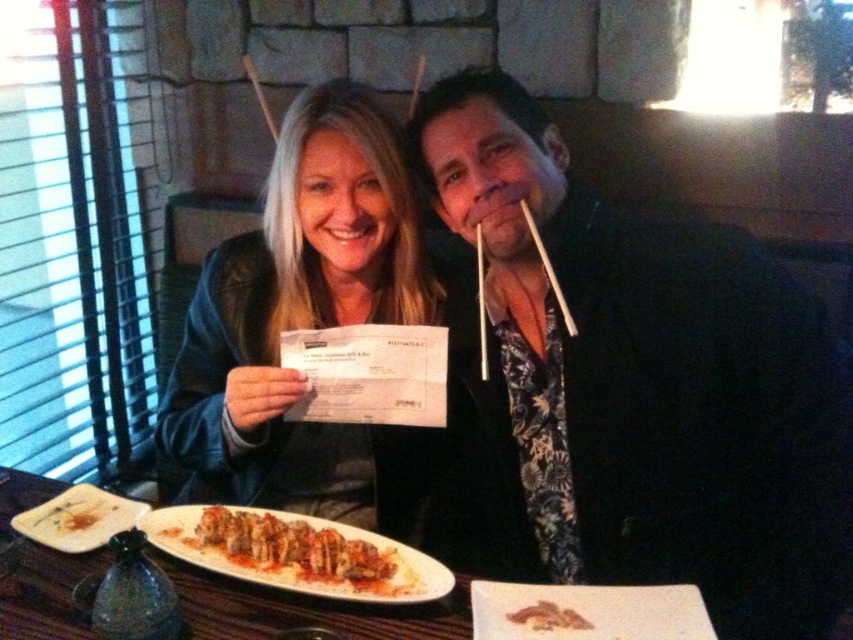
Which is below, matte black jacket at center or golden crispy chicken at center?

golden crispy chicken at center

Between point (256, 502) and point (322, 564), which one is positioned in front?

Positioned in front is point (322, 564).

Based on the photo, who is more forward, (303, 484) or (389, 589)?

Point (389, 589)

The width and height of the screenshot is (853, 640). I want to click on matte black jacket at center, so click(305, 323).

Does matte black jacket at center have a lesser height compared to brown crispy sushi at center?

Incorrect, matte black jacket at center's height does not fall short of brown crispy sushi at center's.

Who is more forward, [271,168] or [509,614]?

Point [509,614] is more forward.

Where is `matte black jacket at center`? matte black jacket at center is located at coordinates (305, 323).

Where is `matte black jacket at center`? matte black jacket at center is located at coordinates (x=305, y=323).

Is golden crispy chicken at center to the left of brown crumbly bread at center from the viewer's perspective?

In fact, golden crispy chicken at center is to the right of brown crumbly bread at center.

From the picture: Does golden crispy chicken at center have a smaller size compared to brown crumbly bread at center?

Incorrect, golden crispy chicken at center is not smaller in size than brown crumbly bread at center.

Is point (305, 532) less distant than point (80, 509)?

That is True.

Where is `golden crispy chicken at center`? The width and height of the screenshot is (853, 640). golden crispy chicken at center is located at coordinates (299, 552).